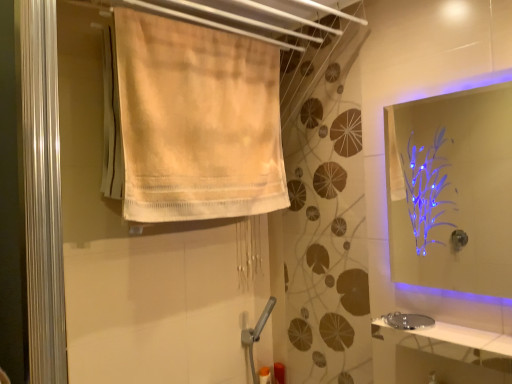
Question: From a real-world perspective, is white glossy counter top at lower right physically located above or below translucent plastic bottle at lower center?

Choices:
 (A) above
 (B) below

Answer: (A)

Question: Is point (442, 337) positioned closer to the camera than point (281, 367)?

Choices:
 (A) closer
 (B) farther

Answer: (A)

Question: Estimate the real-world distances between objects in this image. Which object is farther from the white glossy counter top at lower right?

Choices:
 (A) silver metallic sink at lower right
 (B) translucent plastic bottle at lower center
 (C) transparent acrylic mirror at upper right
 (D) beige cotton towel at upper left

Answer: (C)

Question: Considering the real-world distances, which object is farthest from the transparent acrylic mirror at upper right?

Choices:
 (A) translucent plastic bottle at lower center
 (B) silver metallic sink at lower right
 (C) beige cotton towel at upper left
 (D) white glossy counter top at lower right

Answer: (A)